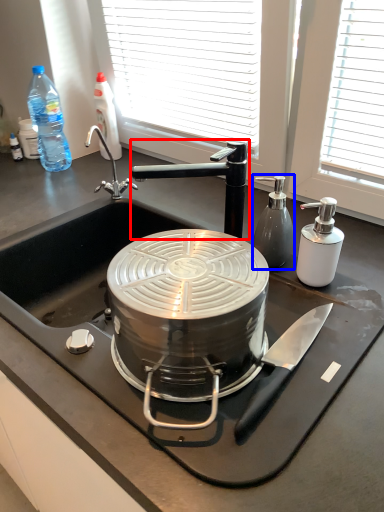
Question: Among these objects, which one is farthest to the camera, tap (highlighted by a red box) or bottle (highlighted by a blue box)?

Choices:
 (A) tap
 (B) bottle

Answer: (B)